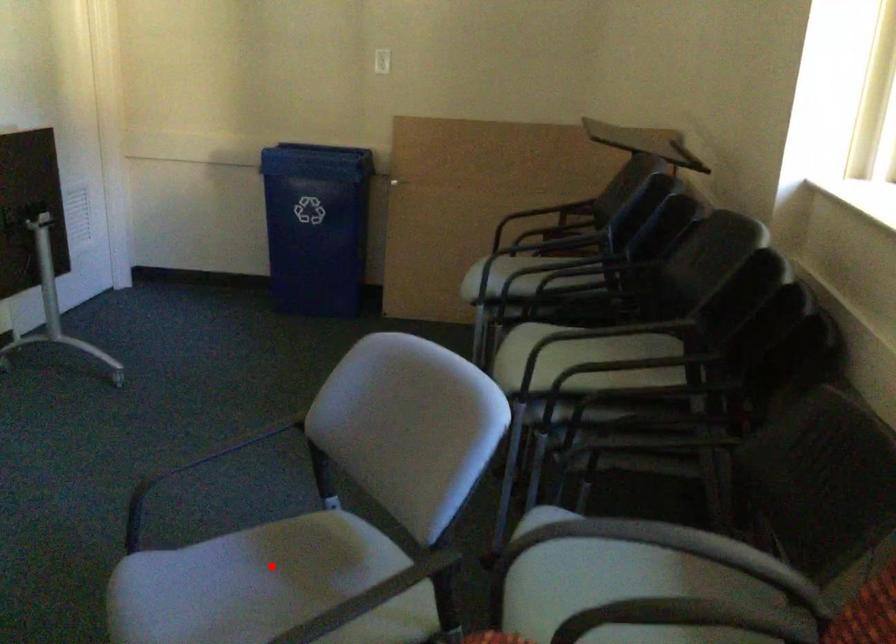
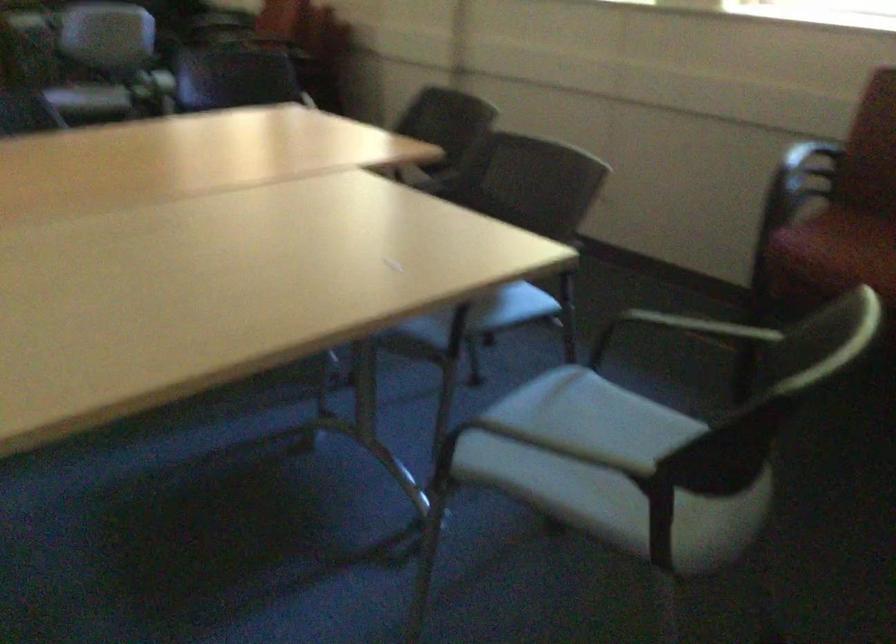
Question: I am providing you with two images of the same scene from different viewpoints. A red point is marked on the first image. At the location where the point appears in image 1, is it still visible in image 2?

Choices:
 (A) Yes
 (B) No

Answer: (B)